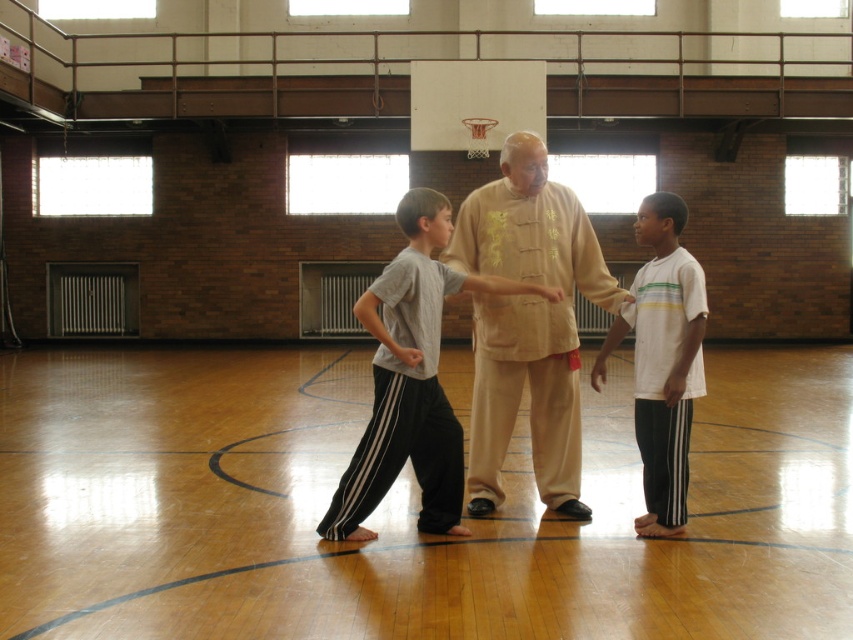
Question: Can you confirm if beige cotton pants at center is positioned to the left of white cotton shirt at center?

Choices:
 (A) yes
 (B) no

Answer: (A)

Question: Which point is farther to the camera?

Choices:
 (A) white cotton shirt at center
 (B) gray cotton shirt at center

Answer: (A)

Question: Can you confirm if wooden floor at center is smaller than gray cotton shirt at center?

Choices:
 (A) yes
 (B) no

Answer: (B)

Question: Is wooden floor at center positioned behind gray cotton shirt at center?

Choices:
 (A) no
 (B) yes

Answer: (A)

Question: Which object appears farthest from the camera in this image?

Choices:
 (A) beige cotton pants at center
 (B) white cotton shirt at center

Answer: (A)

Question: Which object appears farthest from the camera in this image?

Choices:
 (A) gray cotton shirt at center
 (B) beige cotton pants at center
 (C) white cotton shirt at center

Answer: (B)